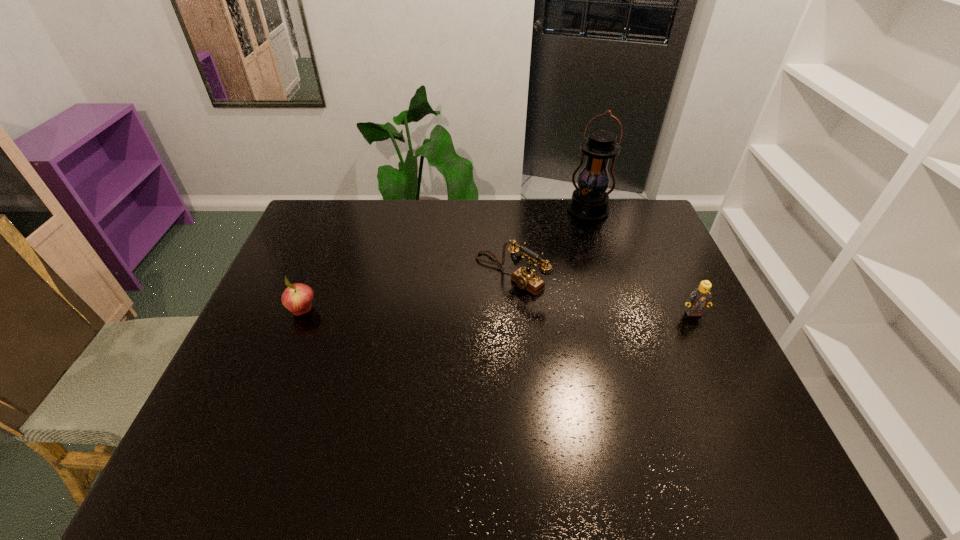
Image resolution: width=960 pixels, height=540 pixels. Find the location of `free spot at the left edge of the desktop`. free spot at the left edge of the desktop is located at coordinates (242, 376).

Locate an element on the screen. This screenshot has width=960, height=540. vacant region at the right edge of the desktop is located at coordinates (708, 390).

The image size is (960, 540). What are the coordinates of `free location at the far right corner of the desktop` in the screenshot? It's located at (640, 228).

The image size is (960, 540). Identify the location of free space at the near right corner. (732, 400).

Where is `free area in between the Lego and the lantern`? The height and width of the screenshot is (540, 960). free area in between the Lego and the lantern is located at coordinates (640, 262).

The width and height of the screenshot is (960, 540). I want to click on empty location between the farthest object and the leftmost object, so click(445, 261).

This screenshot has width=960, height=540. I want to click on vacant region between the apple and the telephone, so [x=407, y=292].

The image size is (960, 540). Find the location of `free space between the second object from left to right and the apple`. free space between the second object from left to right and the apple is located at coordinates (407, 292).

The width and height of the screenshot is (960, 540). I want to click on free space that is in between the Lego and the apple, so click(498, 312).

You are a GUI agent. You are given a task and a screenshot of the screen. Output one action in this format:
    pyautogui.click(x=<x>, y=<y>)
    Task: Click on the vacant area that lies between the second object from right to left and the apple
    
    Given the screenshot: What is the action you would take?
    pyautogui.click(x=445, y=261)